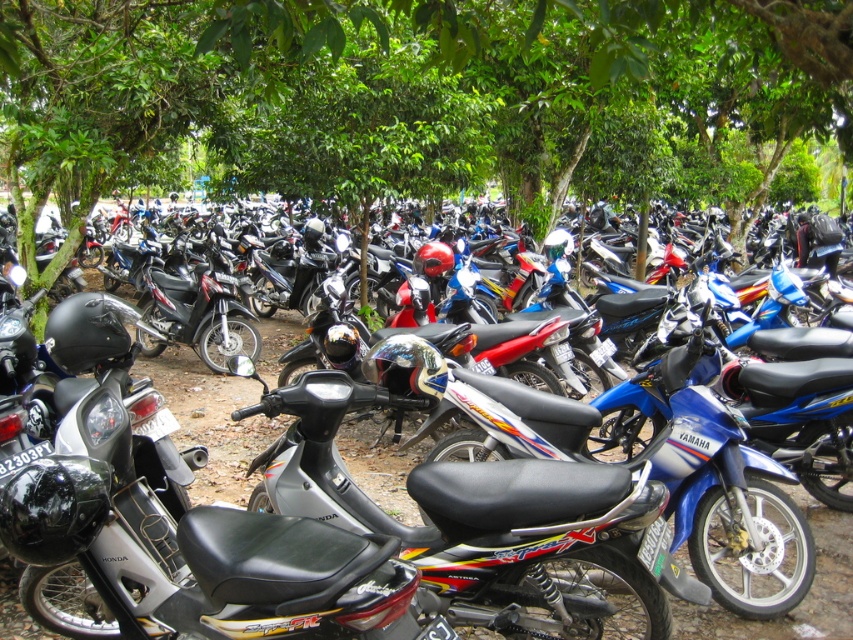
Question: Which point appears farthest from the camera in this image?

Choices:
 (A) (277, 344)
 (B) (660, 60)

Answer: (A)

Question: Which of the following is the farthest from the observer?

Choices:
 (A) (200, 381)
 (B) (253, 19)

Answer: (A)

Question: Considering the relative positions of green leafy tree at center and silver metallic scooter at center in the image provided, where is green leafy tree at center located with respect to silver metallic scooter at center?

Choices:
 (A) above
 (B) below

Answer: (A)

Question: Is green leafy tree at center bigger than silver metallic scooter at center?

Choices:
 (A) yes
 (B) no

Answer: (A)

Question: Is green leafy tree at center bigger than silver metallic scooter at center?

Choices:
 (A) no
 (B) yes

Answer: (B)

Question: Among these objects, which one is nearest to the camera?

Choices:
 (A) green leafy tree at center
 (B) silver metallic scooter at center

Answer: (A)